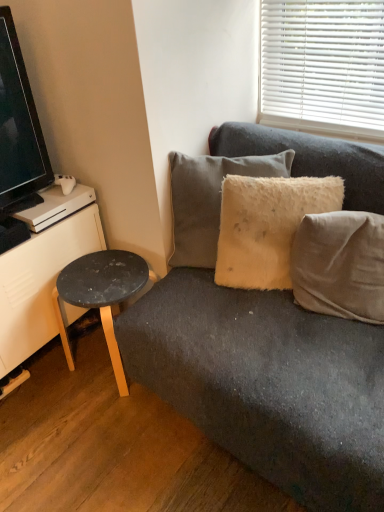
Question: Is black laminate stool at lower left beside white matte dresser at left?

Choices:
 (A) no
 (B) yes

Answer: (A)

Question: Is there a large distance between black laminate stool at lower left and white matte dresser at left?

Choices:
 (A) no
 (B) yes

Answer: (A)

Question: Does black laminate stool at lower left turn towards white matte dresser at left?

Choices:
 (A) yes
 (B) no

Answer: (B)

Question: Can you confirm if black laminate stool at lower left is positioned to the left of white matte dresser at left?

Choices:
 (A) no
 (B) yes

Answer: (A)

Question: Does black laminate stool at lower left appear on the right side of white matte dresser at left?

Choices:
 (A) no
 (B) yes

Answer: (B)

Question: From a real-world perspective, is black laminate stool at lower left beneath white matte dresser at left?

Choices:
 (A) no
 (B) yes

Answer: (B)

Question: Does fuzzy yellow pillow at center, which appears as the 2th pillow when viewed from the left, have a greater height compared to fuzzy beige pillow at upper right, marked as the 1th pillow in a left-to-right arrangement?

Choices:
 (A) yes
 (B) no

Answer: (B)

Question: Does fuzzy yellow pillow at center, arranged as the second pillow when viewed from the right, have a greater width compared to fuzzy beige pillow at upper right, which is the third pillow in right-to-left order?

Choices:
 (A) yes
 (B) no

Answer: (B)

Question: Can you confirm if fuzzy yellow pillow at center, which appears as the 2th pillow when viewed from the left, is thinner than fuzzy beige pillow at upper right, marked as the 1th pillow in a left-to-right arrangement?

Choices:
 (A) yes
 (B) no

Answer: (A)

Question: Is fuzzy beige pillow at upper right, marked as the 1th pillow in a left-to-right arrangement, inside fuzzy yellow pillow at center, arranged as the second pillow when viewed from the right?

Choices:
 (A) yes
 (B) no

Answer: (B)

Question: Is the position of fuzzy yellow pillow at center, arranged as the second pillow when viewed from the right, less distant than that of fuzzy beige pillow at upper right, which is the third pillow in right-to-left order?

Choices:
 (A) yes
 (B) no

Answer: (A)

Question: Is fuzzy yellow pillow at center, arranged as the second pillow when viewed from the right, aimed at fuzzy beige pillow at upper right, which is the third pillow in right-to-left order?

Choices:
 (A) no
 (B) yes

Answer: (B)

Question: Does black glossy tv at left have a greater width compared to black laminate stool at lower left?

Choices:
 (A) no
 (B) yes

Answer: (A)